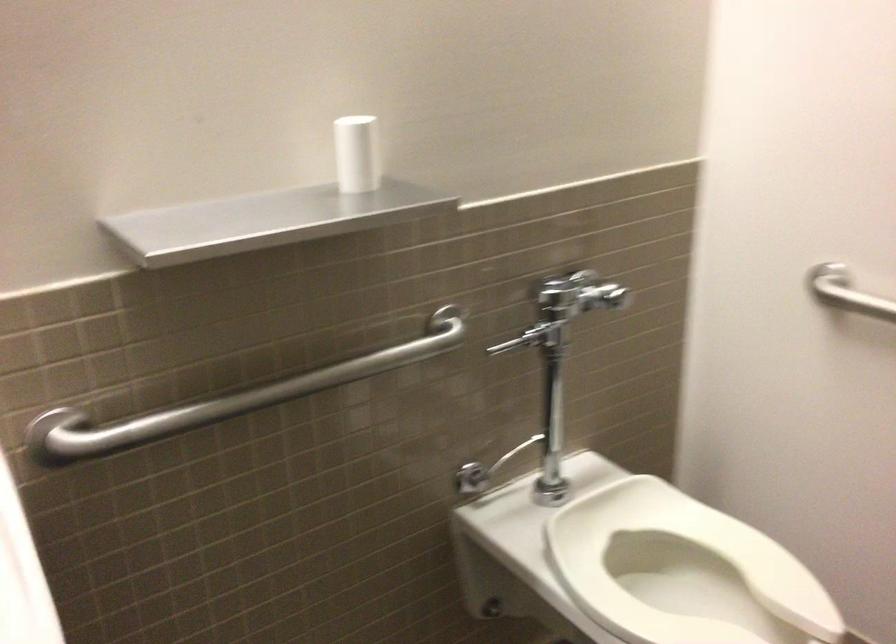
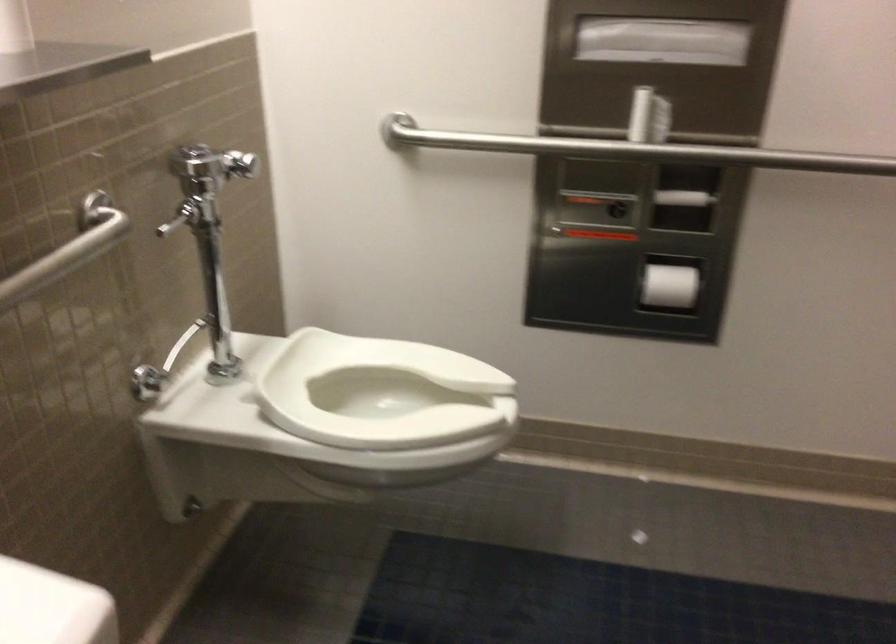
Where in the second image is the point corresponding to point 462,480 from the first image?

(147, 383)